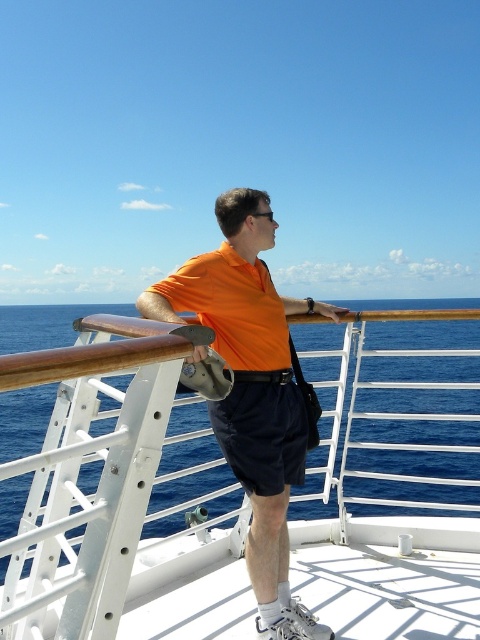
Question: Which of the following is the farthest from the observer?

Choices:
 (A) blue water at center
 (B) orange matte shirt at center
 (C) navy blue shorts at center

Answer: (C)

Question: Which point is closer to the camera?

Choices:
 (A) orange matte shirt at center
 (B) blue water at center

Answer: (B)

Question: Does blue water at center come in front of navy blue shorts at center?

Choices:
 (A) yes
 (B) no

Answer: (A)

Question: Which of the following is the closest to the observer?

Choices:
 (A) (273, 561)
 (B) (39, 470)

Answer: (B)

Question: Does blue water at center appear under orange matte shirt at center?

Choices:
 (A) yes
 (B) no

Answer: (A)

Question: Does blue water at center have a greater width compared to orange matte shirt at center?

Choices:
 (A) yes
 (B) no

Answer: (A)